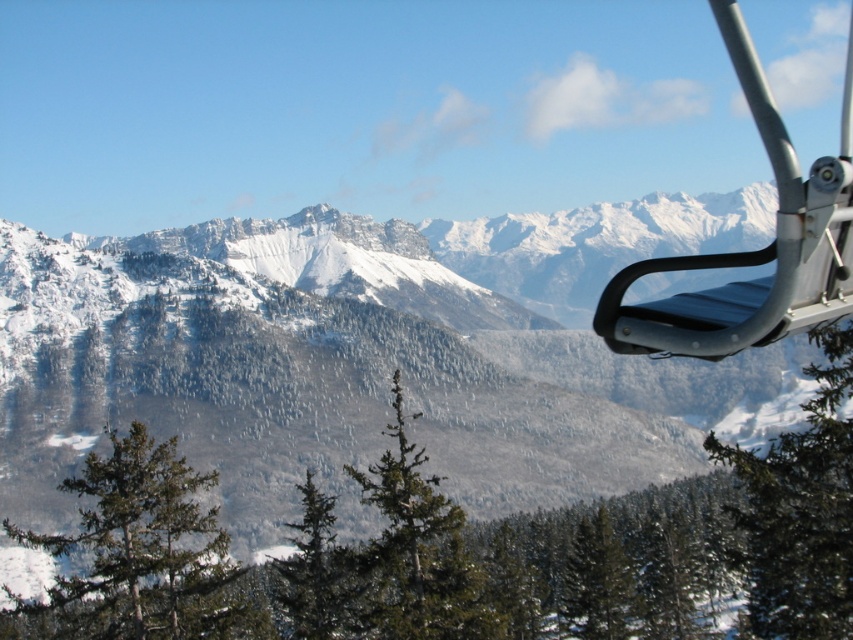
Question: Considering the relative positions of snowy mountain range at upper center and green matte tree at lower right in the image provided, where is snowy mountain range at upper center located with respect to green matte tree at lower right?

Choices:
 (A) below
 (B) above

Answer: (B)

Question: Which object is closer to the camera taking this photo?

Choices:
 (A) green matte tree at lower left
 (B) metallic blue seat at upper right
 (C) green textured tree at center

Answer: (B)

Question: Can you confirm if snowy mountain range at upper center is positioned above green matte tree at lower right?

Choices:
 (A) yes
 (B) no

Answer: (A)

Question: Can you confirm if metallic blue seat at upper right is bigger than green textured tree at center?

Choices:
 (A) no
 (B) yes

Answer: (B)

Question: Among these points, which one is farthest from the camera?

Choices:
 (A) (793, 564)
 (B) (148, 436)
 (C) (431, 579)

Answer: (B)

Question: Which point is closer to the camera taking this photo?

Choices:
 (A) (753, 496)
 (B) (746, 65)

Answer: (B)